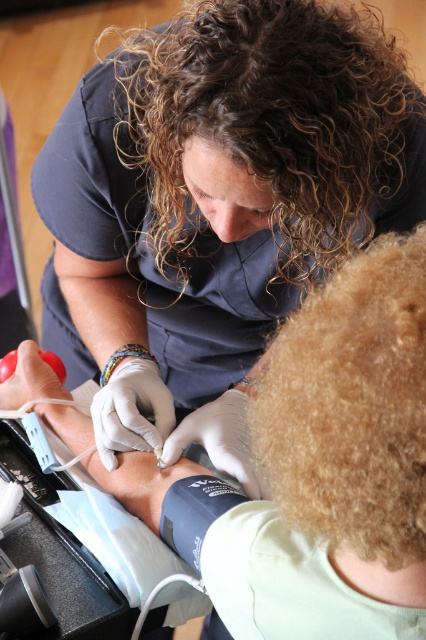
Question: Which point is farther to the camera?

Choices:
 (A) curly golden hair at lower right
 (B) curly brown hair at upper center

Answer: (B)

Question: Is curly brown hair at upper center thinner than curly golden hair at lower right?

Choices:
 (A) no
 (B) yes

Answer: (A)

Question: Which object appears farthest from the camera in this image?

Choices:
 (A) curly golden hair at lower right
 (B) curly brown hair at upper center

Answer: (B)

Question: Is curly brown hair at upper center in front of curly golden hair at lower right?

Choices:
 (A) yes
 (B) no

Answer: (B)

Question: Is curly brown hair at upper center positioned before curly golden hair at lower right?

Choices:
 (A) no
 (B) yes

Answer: (A)